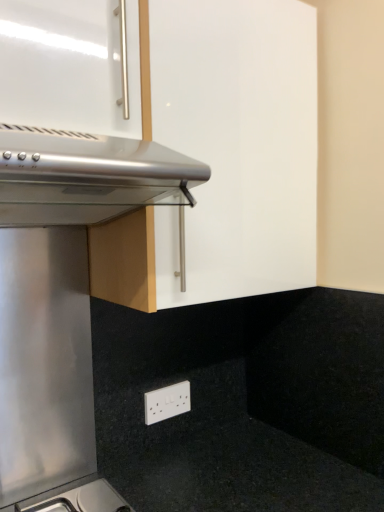
Question: Is satin silver oven at upper left facing away from matte white cabinet at upper center?

Choices:
 (A) no
 (B) yes

Answer: (B)

Question: Is satin silver oven at upper left positioned far away from matte white cabinet at upper center?

Choices:
 (A) no
 (B) yes

Answer: (A)

Question: Is satin silver oven at upper left surrounding matte white cabinet at upper center?

Choices:
 (A) no
 (B) yes

Answer: (A)

Question: Does satin silver oven at upper left have a smaller size compared to matte white cabinet at upper center?

Choices:
 (A) yes
 (B) no

Answer: (A)

Question: Can you confirm if satin silver oven at upper left is taller than matte white cabinet at upper center?

Choices:
 (A) yes
 (B) no

Answer: (B)

Question: From the image's perspective, is satin silver oven at upper left above matte white cabinet at upper center?

Choices:
 (A) yes
 (B) no

Answer: (B)

Question: From a real-world perspective, is white plastic electric outlet at lower center on top of matte white cabinet at upper center?

Choices:
 (A) no
 (B) yes

Answer: (A)

Question: Considering the relative sizes of white plastic electric outlet at lower center and matte white cabinet at upper center in the image provided, is white plastic electric outlet at lower center wider than matte white cabinet at upper center?

Choices:
 (A) no
 (B) yes

Answer: (A)

Question: Is white plastic electric outlet at lower center at the left side of matte white cabinet at upper center?

Choices:
 (A) yes
 (B) no

Answer: (B)

Question: Can you confirm if white plastic electric outlet at lower center is smaller than matte white cabinet at upper center?

Choices:
 (A) no
 (B) yes

Answer: (B)

Question: From the image's perspective, is white plastic electric outlet at lower center over matte white cabinet at upper center?

Choices:
 (A) yes
 (B) no

Answer: (B)

Question: Are white plastic electric outlet at lower center and matte white cabinet at upper center located far from each other?

Choices:
 (A) no
 (B) yes

Answer: (A)

Question: Can we say matte white cabinet at upper center lies outside white plastic electric outlet at lower center?

Choices:
 (A) no
 (B) yes

Answer: (B)